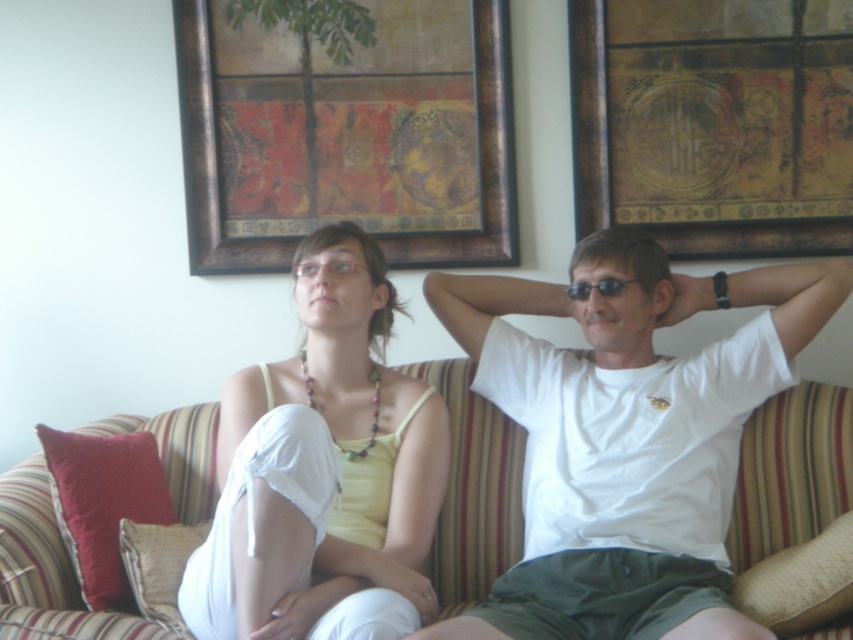
Question: Which point is closer to the camera?

Choices:
 (A) wooden picture frame at upper center
 (B) white fabric at center

Answer: (B)

Question: Does wooden framed artwork at upper center have a larger size compared to black plastic sunglasses at upper right?

Choices:
 (A) yes
 (B) no

Answer: (A)

Question: Can you confirm if velvet red pillow at left is positioned to the right of beige fabric pillow at lower right?

Choices:
 (A) yes
 (B) no

Answer: (B)

Question: Considering the relative positions of beige fabric pillow at lower right and beige fabric pillow at lower left in the image provided, where is beige fabric pillow at lower right located with respect to beige fabric pillow at lower left?

Choices:
 (A) left
 (B) right

Answer: (B)

Question: Which point is farther to the camera?

Choices:
 (A) (711, 536)
 (B) (109, 552)

Answer: (A)

Question: Which object is the closest to the white fabric at center?

Choices:
 (A) white cotton t-shirt at right
 (B) black plastic sunglasses at upper right
 (C) wooden framed artwork at upper center

Answer: (A)